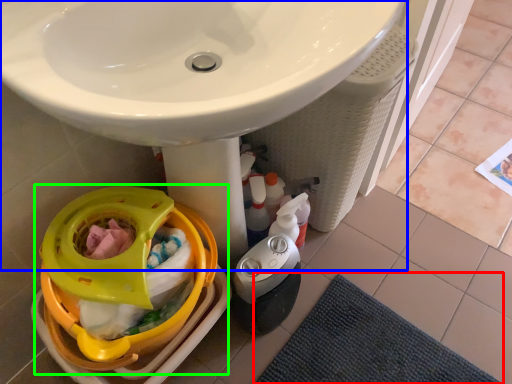
Question: Which object is positioned closest to bath mat (highlighted by a red box)? Select from sink (highlighted by a blue box) and baby carriage (highlighted by a green box).

Choices:
 (A) sink
 (B) baby carriage

Answer: (B)